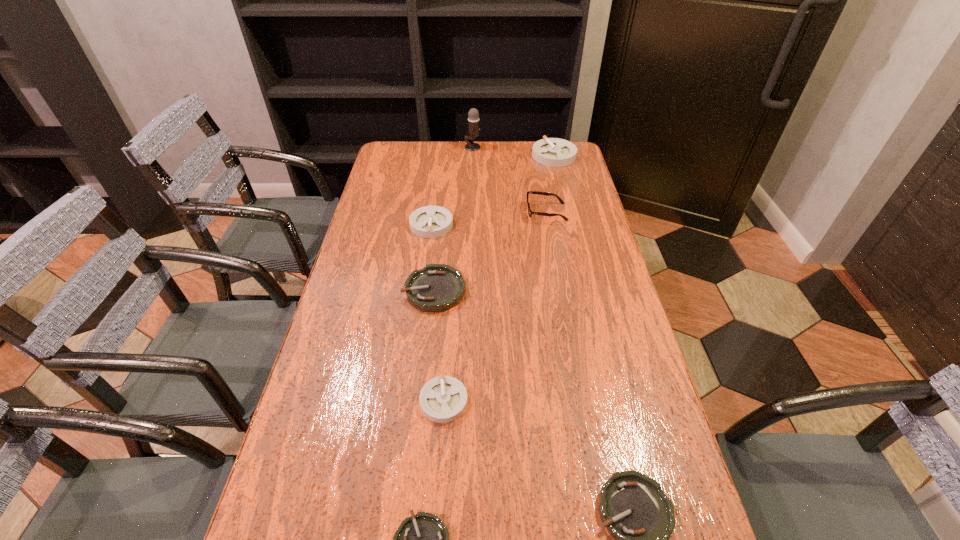
Identify the location of vacant area that lies between the fifth shortest ashtray and the microphone. Image resolution: width=960 pixels, height=540 pixels. (452, 186).

The image size is (960, 540). Find the location of `empty location between the gray microphone and the farthest ashtray`. empty location between the gray microphone and the farthest ashtray is located at coordinates (514, 151).

The width and height of the screenshot is (960, 540). Identify the location of free space between the farthest ashtray and the second farthest gray ashtray. (492, 190).

What are the coordinates of `object that stands as the third closest to the rightmost green ashtray` in the screenshot? It's located at (437, 287).

At what (x,y) coordinates should I click in order to perform the action: click on object that is the fourth closest to the fifth farthest object. Please return your answer as a coordinate pair (x, y). Looking at the image, I should click on (423, 539).

Where is `the second closest ashtray to the rightmost gray ashtray`? the second closest ashtray to the rightmost gray ashtray is located at coordinates (437, 287).

What are the coordinates of `the closest ashtray to the shortest ashtray` in the screenshot? It's located at (443, 399).

Select which gray ashtray is the closest to the gray microphone. Please provide its 2D coordinates. Your answer should be formatted as a tuple, i.e. [(x, y)], where the tuple contains the x and y coordinates of a point satisfying the conditions above.

[(554, 152)]

Point out which gray ashtray is positioned as the second nearest to the spectacles. Please provide its 2D coordinates. Your answer should be formatted as a tuple, i.e. [(x, y)], where the tuple contains the x and y coordinates of a point satisfying the conditions above.

[(429, 221)]

At what (x,y) coordinates should I click in order to perform the action: click on green ashtray that is the second nearest to the biggest green ashtray. Please return your answer as a coordinate pair (x, y). The image size is (960, 540). Looking at the image, I should click on (636, 512).